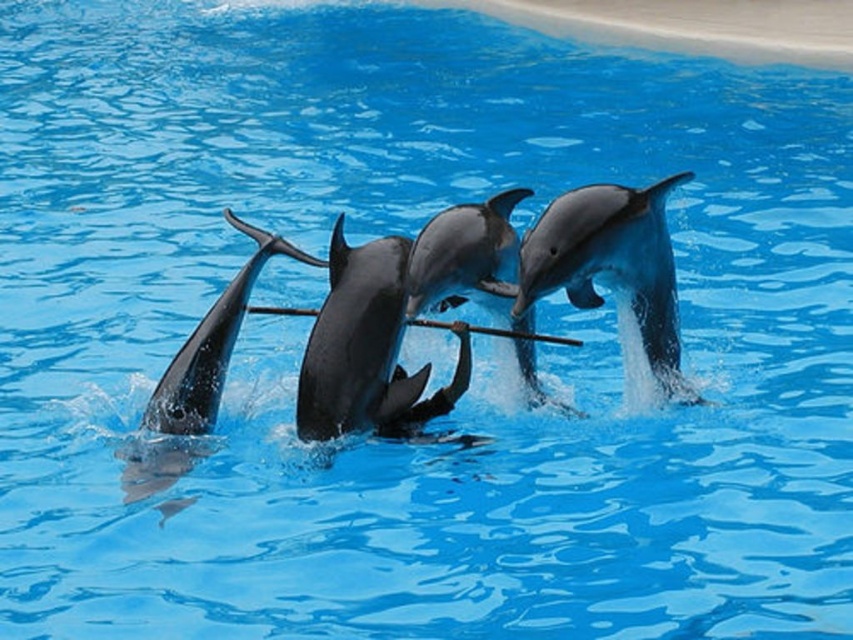
Can you confirm if shiny gray dolphin at center is thinner than shiny black dolphin at center?

In fact, shiny gray dolphin at center might be wider than shiny black dolphin at center.

Is shiny gray dolphin at center taller than shiny black dolphin at center?

Indeed, shiny gray dolphin at center has a greater height compared to shiny black dolphin at center.

Between point (541, 260) and point (384, 404), which one is positioned behind?

The point (384, 404) is more distant.

Locate an element on the screen. shiny gray dolphin at center is located at coordinates (614, 275).

Is shiny gray dolphin at center below shiny black dolphin at lower left?

Incorrect, shiny gray dolphin at center is not positioned below shiny black dolphin at lower left.

Can you confirm if shiny gray dolphin at center is wider than shiny black dolphin at lower left?

Yes, shiny gray dolphin at center is wider than shiny black dolphin at lower left.

The image size is (853, 640). Describe the element at coordinates (614, 275) in the screenshot. I see `shiny gray dolphin at center` at that location.

Find the location of a particular element. shiny gray dolphin at center is located at coordinates (614, 275).

Is shiny black dolphin at center above shiny black dolphin at lower left?

Indeed, shiny black dolphin at center is positioned over shiny black dolphin at lower left.

Is shiny black dolphin at center positioned before shiny black dolphin at lower left?

Yes, shiny black dolphin at center is in front of shiny black dolphin at lower left.

Find the location of a particular element. shiny black dolphin at center is located at coordinates [x=357, y=342].